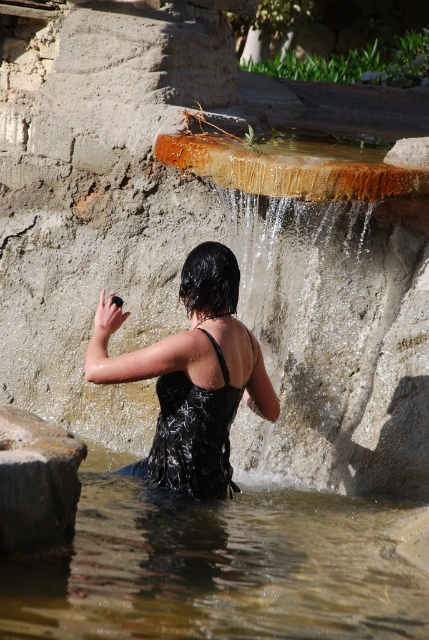
Question: Is the position of clear water at center more distant than that of smooth gray rock at lower left?

Choices:
 (A) no
 (B) yes

Answer: (A)

Question: Is wet black swimsuit at center bigger than smooth gray rock at lower left?

Choices:
 (A) yes
 (B) no

Answer: (A)

Question: Which point appears farthest from the camera in this image?

Choices:
 (A) (81, 458)
 (B) (190, 454)

Answer: (B)

Question: Which object appears closest to the camera in this image?

Choices:
 (A) wet black swimsuit at center
 (B) clear water at center

Answer: (B)

Question: Which of the following is the closest to the observer?

Choices:
 (A) wet black swimsuit at center
 (B) clear water at center

Answer: (B)

Question: Can you confirm if wet black swimsuit at center is thinner than smooth gray rock at lower left?

Choices:
 (A) yes
 (B) no

Answer: (B)